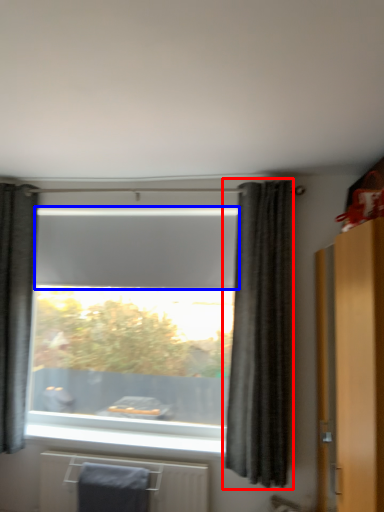
Question: Which of the following is the closest to the observer, curtain (highlighted by a red box) or blind (highlighted by a blue box)?

Choices:
 (A) curtain
 (B) blind

Answer: (A)